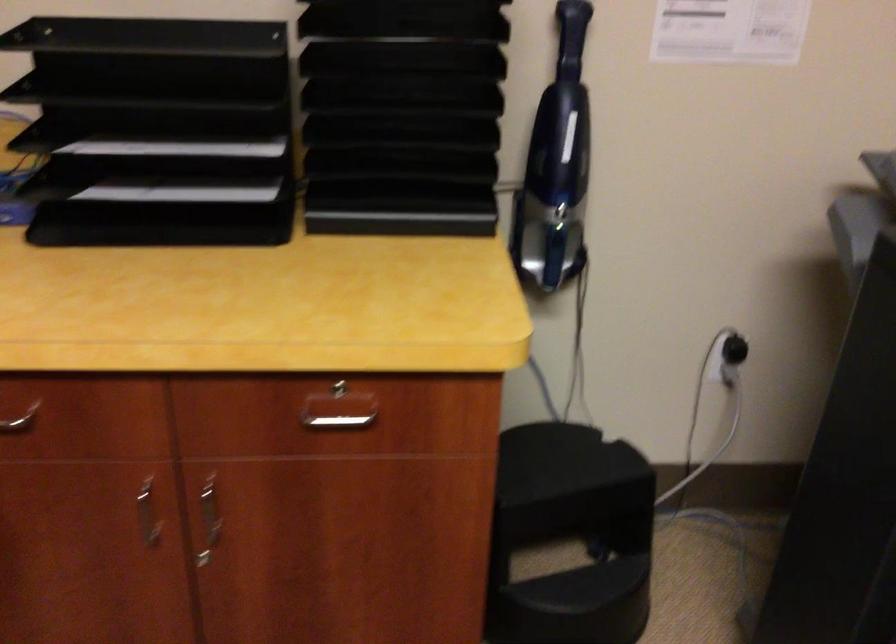
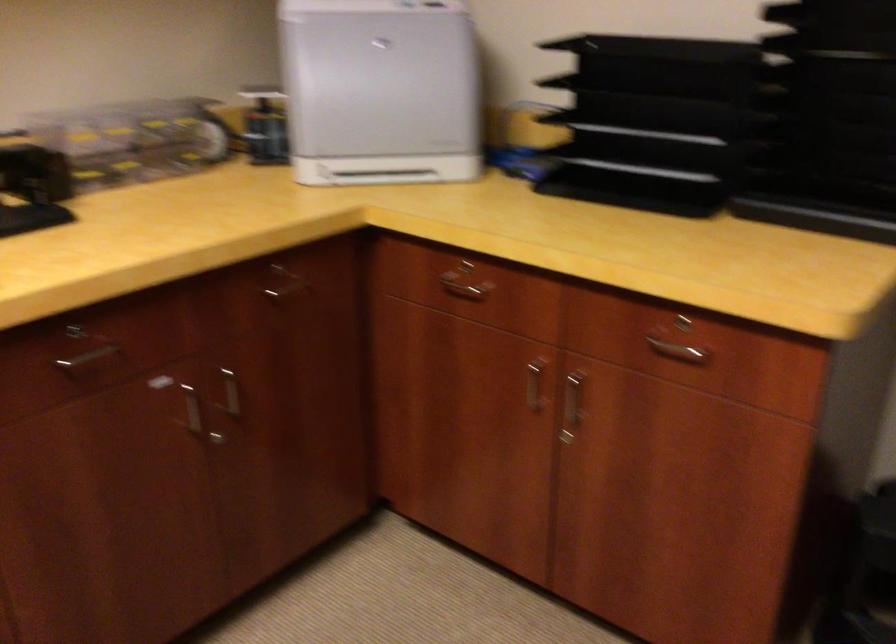
Where in the second image is the point corresponding to point 337,384 from the first image?

(686, 321)